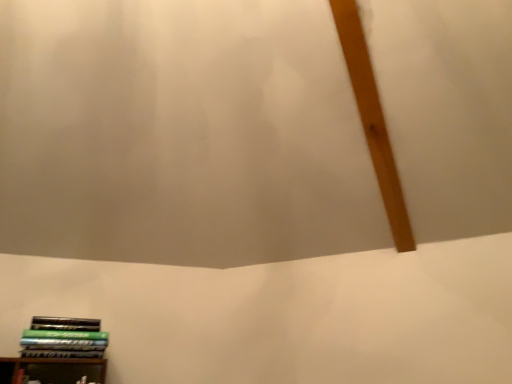
Describe the element at coordinates (64, 338) in the screenshot. I see `green matte book at lower left` at that location.

Locate an element on the screen. This screenshot has height=384, width=512. green matte book at lower left is located at coordinates (64, 338).

The width and height of the screenshot is (512, 384). What are the coordinates of `green matte book at lower left` in the screenshot? It's located at (64, 338).